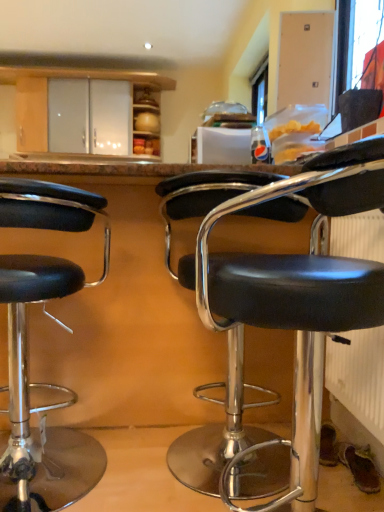
Question: Should I look upward or downward to see black leather stool at left, arranged as the 2th chair when viewed from the right?

Choices:
 (A) up
 (B) down

Answer: (B)

Question: Is black leather stool at left, which is the 1th chair in left-to-right order, bigger than white textured radiator at lower right?

Choices:
 (A) no
 (B) yes

Answer: (B)

Question: Does black leather stool at left, which is the 1th chair in left-to-right order, have a lesser width compared to white textured radiator at lower right?

Choices:
 (A) no
 (B) yes

Answer: (A)

Question: From a real-world perspective, is black leather stool at left, arranged as the 2th chair when viewed from the right, under white textured radiator at lower right?

Choices:
 (A) no
 (B) yes

Answer: (B)

Question: Is black leather stool at left, arranged as the 2th chair when viewed from the right, positioned in front of white textured radiator at lower right?

Choices:
 (A) no
 (B) yes

Answer: (B)

Question: Are black leather stool at left, which is the 1th chair in left-to-right order, and white textured radiator at lower right far apart?

Choices:
 (A) no
 (B) yes

Answer: (A)

Question: Can you confirm if black leather stool at left, arranged as the 2th chair when viewed from the right, is shorter than white textured radiator at lower right?

Choices:
 (A) yes
 (B) no

Answer: (B)

Question: Does black leather stool at left, which is the 1th chair in left-to-right order, have a greater height compared to black leather stool at center, placed as the 2th chair when sorted from left to right?

Choices:
 (A) yes
 (B) no

Answer: (B)

Question: From a real-world perspective, is black leather stool at left, arranged as the 2th chair when viewed from the right, positioned over black leather stool at center, placed as the 2th chair when sorted from left to right, based on gravity?

Choices:
 (A) no
 (B) yes

Answer: (A)

Question: From the image's perspective, is black leather stool at left, which is the 1th chair in left-to-right order, below black leather stool at center, placed as the 2th chair when sorted from left to right?

Choices:
 (A) no
 (B) yes

Answer: (A)

Question: Considering the relative sizes of black leather stool at left, arranged as the 2th chair when viewed from the right, and black leather stool at center, placed as the 2th chair when sorted from left to right, in the image provided, is black leather stool at left, arranged as the 2th chair when viewed from the right, shorter than black leather stool at center, placed as the 2th chair when sorted from left to right,?

Choices:
 (A) no
 (B) yes

Answer: (B)

Question: Is black leather stool at left, arranged as the 2th chair when viewed from the right, next to black leather stool at center, placed as the 2th chair when sorted from left to right?

Choices:
 (A) no
 (B) yes

Answer: (A)

Question: Is black leather stool at left, arranged as the 2th chair when viewed from the right, smaller than black leather stool at center, placed as the 2th chair when sorted from left to right?

Choices:
 (A) no
 (B) yes

Answer: (B)

Question: Considering the relative sizes of white textured radiator at lower right and black leather stool at left, which is the 1th chair in left-to-right order, in the image provided, is white textured radiator at lower right taller than black leather stool at left, which is the 1th chair in left-to-right order,?

Choices:
 (A) yes
 (B) no

Answer: (B)